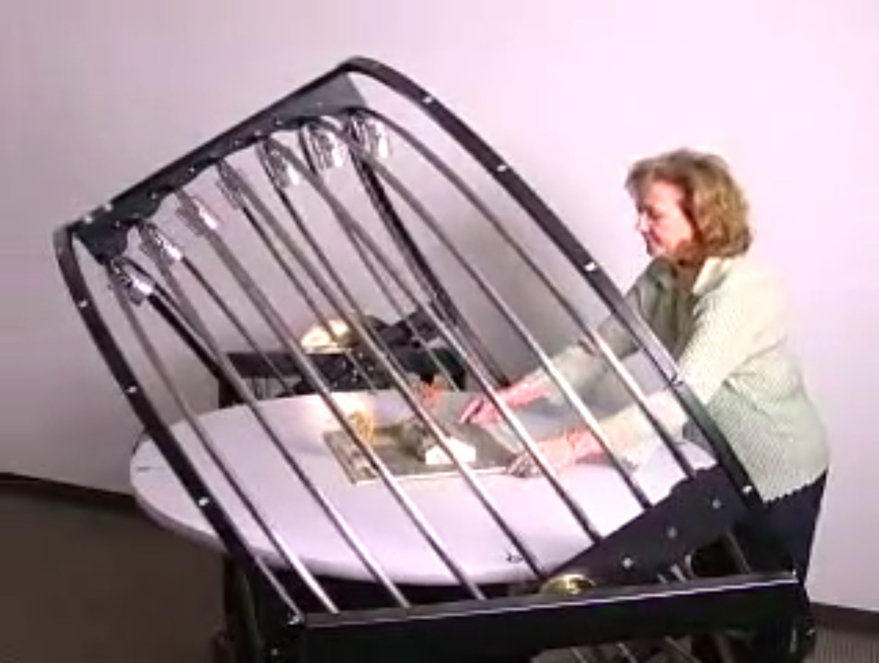
I want to click on fan, so click(x=604, y=618).